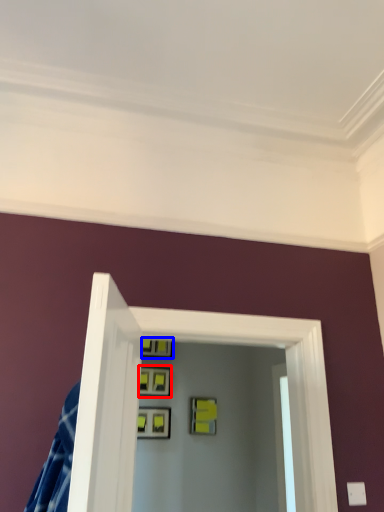
Question: Which of the following is the closest to the observer, picture frame (highlighted by a red box) or picture frame (highlighted by a blue box)?

Choices:
 (A) picture frame
 (B) picture frame

Answer: (A)